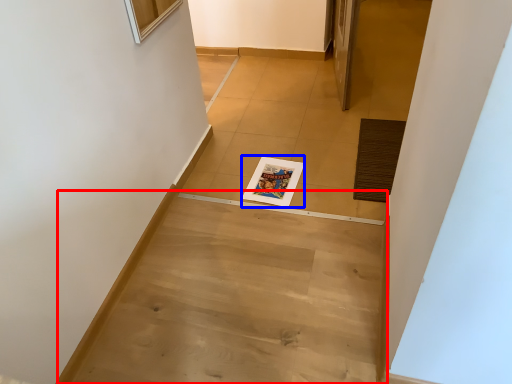
Question: Which object is further to the camera taking this photo, stairwell (highlighted by a red box) or magazine (highlighted by a blue box)?

Choices:
 (A) stairwell
 (B) magazine

Answer: (B)